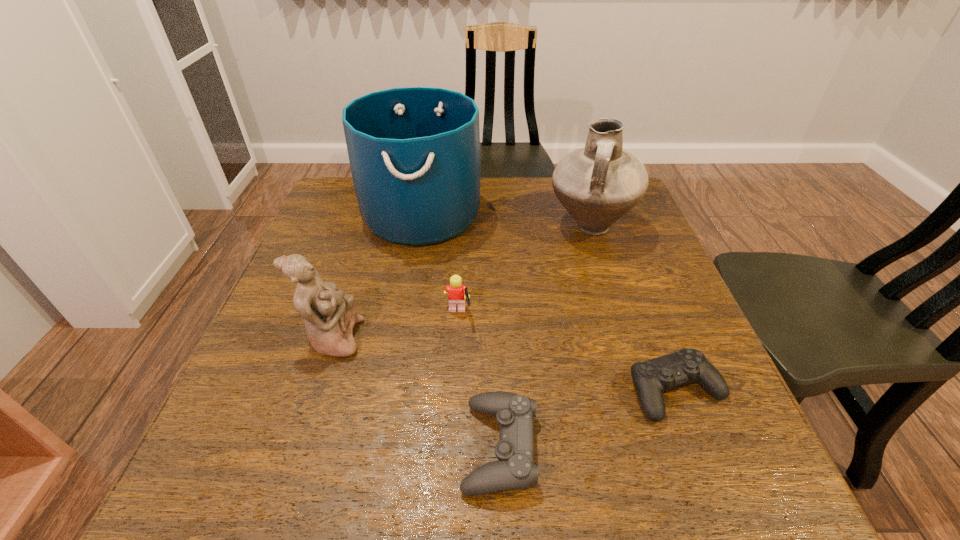
Where is `vacant space in between the bucket and the figurine`? The height and width of the screenshot is (540, 960). vacant space in between the bucket and the figurine is located at coordinates (377, 276).

Find the location of a particular element. Image resolution: width=960 pixels, height=540 pixels. empty space that is in between the left control and the right control is located at coordinates (588, 419).

Select which object appears as the third closest to the bucket. Please provide its 2D coordinates. Your answer should be formatted as a tuple, i.e. [(x, y)], where the tuple contains the x and y coordinates of a point satisfying the conditions above.

[(330, 316)]

Find the location of `object that is the fourth closest one to the Lego`. object that is the fourth closest one to the Lego is located at coordinates (598, 184).

Identify the location of free space that satisfies the following two spatial constraints: 1. on the handle side of the pitcher; 2. in front of the fourth tallest object with the accessory visible. This screenshot has height=540, width=960. (617, 314).

In order to click on free space that satisfies the following two spatial constraints: 1. in front of the fourth tallest object with the accessory visible; 2. on the right side of the right control in this screenshot , I will do `click(454, 391)`.

Find the location of `vacant point that satisfies the following two spatial constraints: 1. on the handle side of the right control; 2. on the right side of the pitcher`. vacant point that satisfies the following two spatial constraints: 1. on the handle side of the right control; 2. on the right side of the pitcher is located at coordinates (641, 391).

You are a GUI agent. You are given a task and a screenshot of the screen. Output one action in this format:
    pyautogui.click(x=<x>, y=<y>)
    Task: Click on the vacant space that satisfies the following two spatial constraints: 1. in front of the third shortest object with the accessory visible; 2. on the left side of the right control
    
    Given the screenshot: What is the action you would take?
    pyautogui.click(x=454, y=391)

Locate an element on the screen. vacant region that satisfies the following two spatial constraints: 1. in front of the right control with the accessory visible; 2. on the left side of the third shortest object is located at coordinates (454, 391).

The width and height of the screenshot is (960, 540). What are the coordinates of `free space that satisfies the following two spatial constraints: 1. on the back side of the left control; 2. in front of the third shortest object with the accessory visible` in the screenshot? It's located at (495, 314).